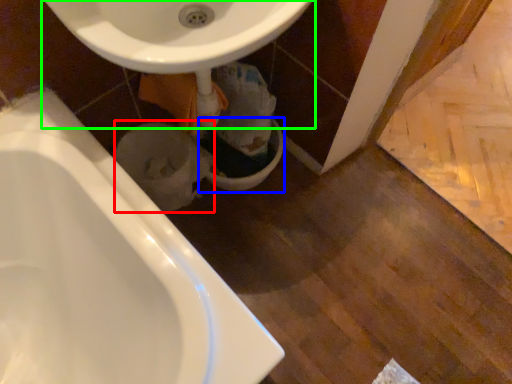
Question: Considering the real-world distances, which object is farthest from toilet bowl (highlighted by a red box)? toilet bowl (highlighted by a blue box) or sink (highlighted by a green box)?

Choices:
 (A) toilet bowl
 (B) sink

Answer: (B)